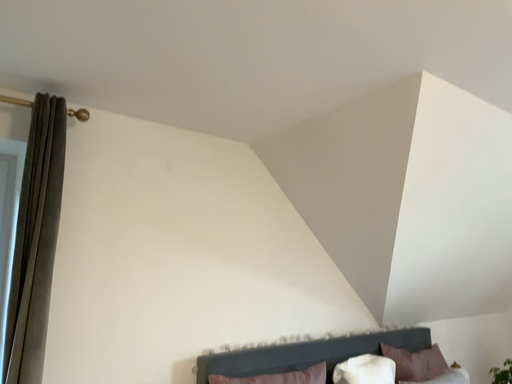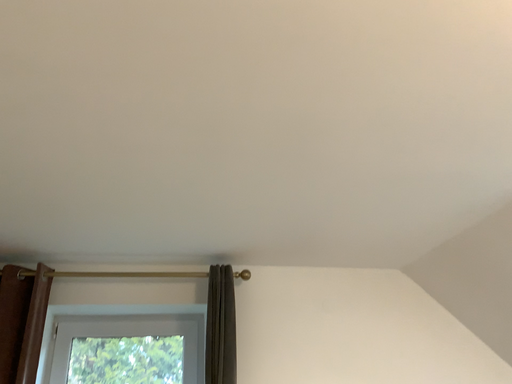
Question: How did the camera likely rotate when shooting the video?

Choices:
 (A) rotated right
 (B) rotated left

Answer: (B)